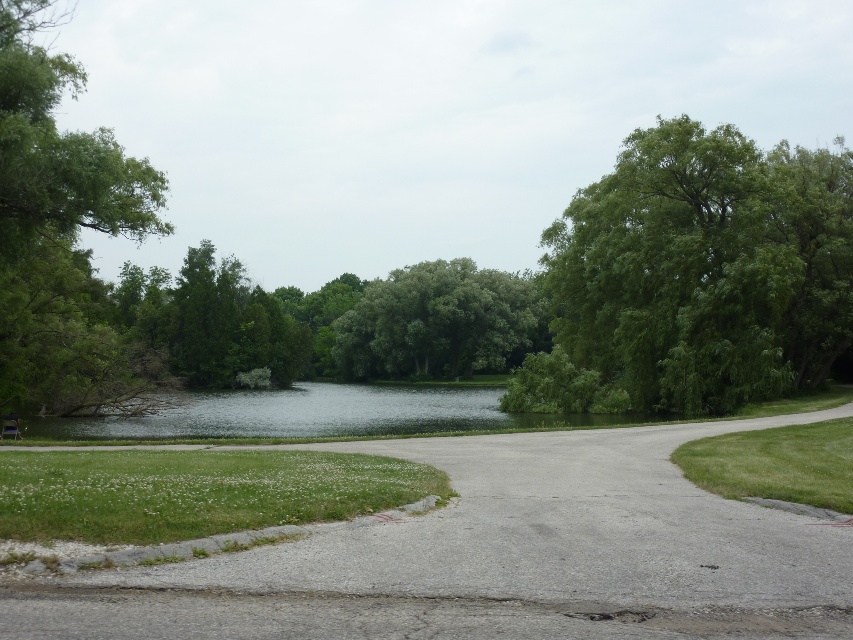
You are driving a car that is 2 meters wide. You want to drive through the gray asphalt driveway at center and pass by the green leafy tree at upper right. Will your car fit through the driveway without hitting the tree?

The gray asphalt driveway at center is thinner than green leafy tree at upper right. Since the driveway is only as wide as 2 meters, the car might not fit without hitting the tree.

You are standing at the entrance of the park and want to walk to the green leafy tree at upper right. However, there is a gray asphalt driveway at center in your way. Can you walk directly to the tree without crossing the driveway?

The gray asphalt driveway at center is in front of green leafy tree at upper right, so you must cross the driveway to reach the tree.